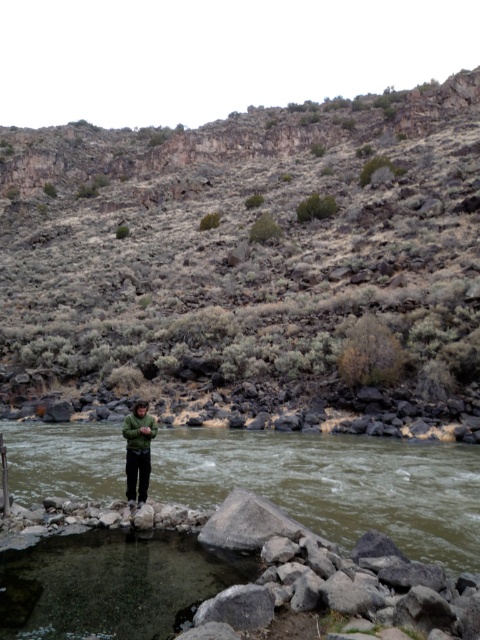
You are a hiker who wants to take a photo of the green matte jacket at center from the brown rocky hillside at upper center. Is the hillside high enough to give a clear view of the jacket?

The brown rocky hillside at upper center is located above green matte jacket at center, so yes, the hillside is high enough to provide a clear view of the jacket.

You are a hiker who wants to cross the river. You see the green fabric river at center and the green matte jacket at center. Which object is closer to you, and why?

The green fabric river at center is closer to you because it is positioned in front of the green matte jacket at center, making it appear nearer in the scene.